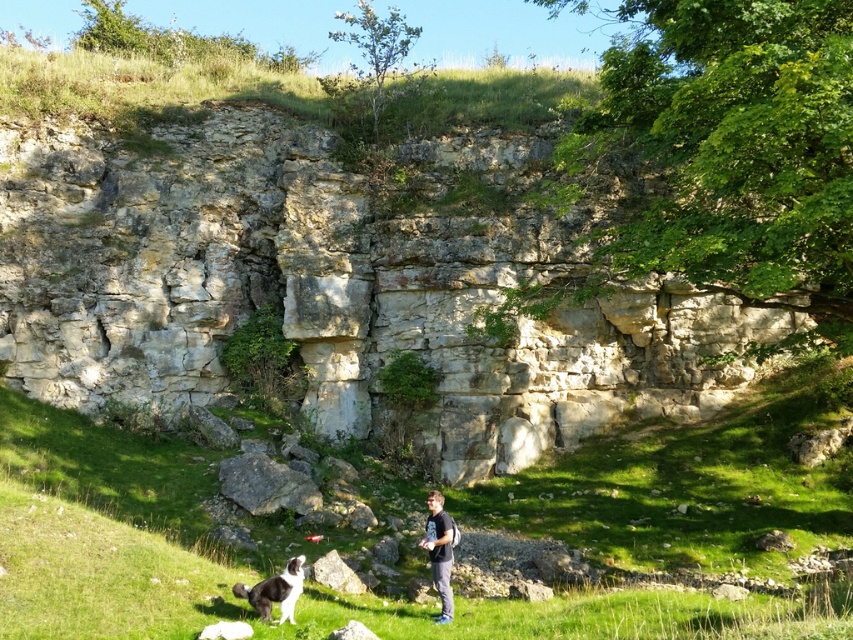
Does green grassy at lower center appear under dark gray t-shirt at center?

No.

The height and width of the screenshot is (640, 853). What do you see at coordinates (119, 531) in the screenshot?
I see `green grassy at lower center` at bounding box center [119, 531].

Where is `green grassy at lower center`? The height and width of the screenshot is (640, 853). green grassy at lower center is located at coordinates coord(119,531).

Does dark gray t-shirt at center have a lesser width compared to black and white fur at lower left?

Yes.

Does dark gray t-shirt at center have a larger size compared to black and white fur at lower left?

Actually, dark gray t-shirt at center might be smaller than black and white fur at lower left.

Where is `dark gray t-shirt at center`? The image size is (853, 640). dark gray t-shirt at center is located at coordinates (439, 552).

Which is more to the right, green grassy at lower center or black and white fur at lower left?

From the viewer's perspective, green grassy at lower center appears more on the right side.

Is point (181, 628) positioned in front of point (279, 593)?

Yes, point (181, 628) is closer to viewer.

Locate an element on the screen. green grassy at lower center is located at coordinates (119, 531).